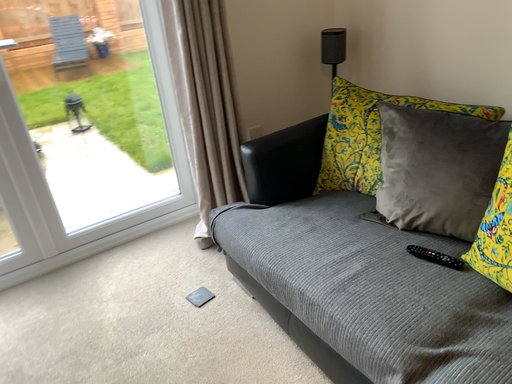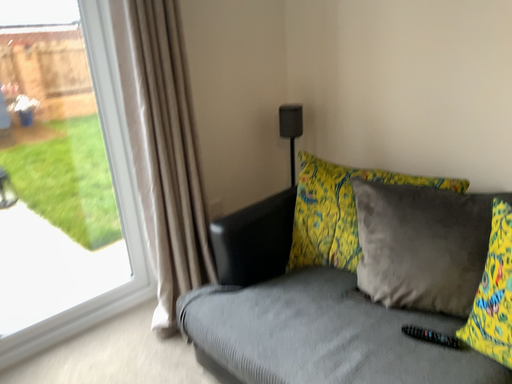
Question: Which way did the camera rotate in the video?

Choices:
 (A) rotated left
 (B) rotated right

Answer: (B)